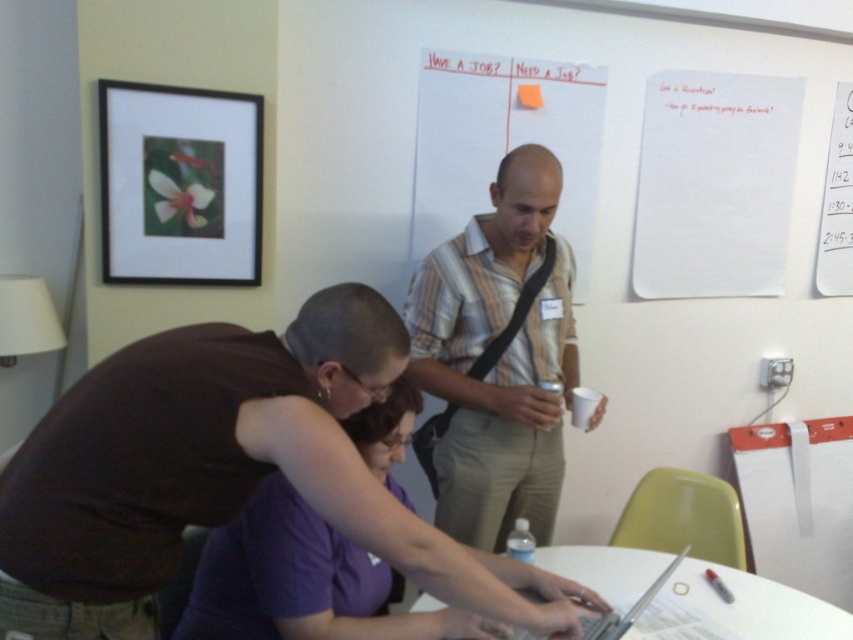
Based on the coordinates provided, which object in the scene is located at point (755, 605)?

The point (755, 605) indicates the white glossy table at center.